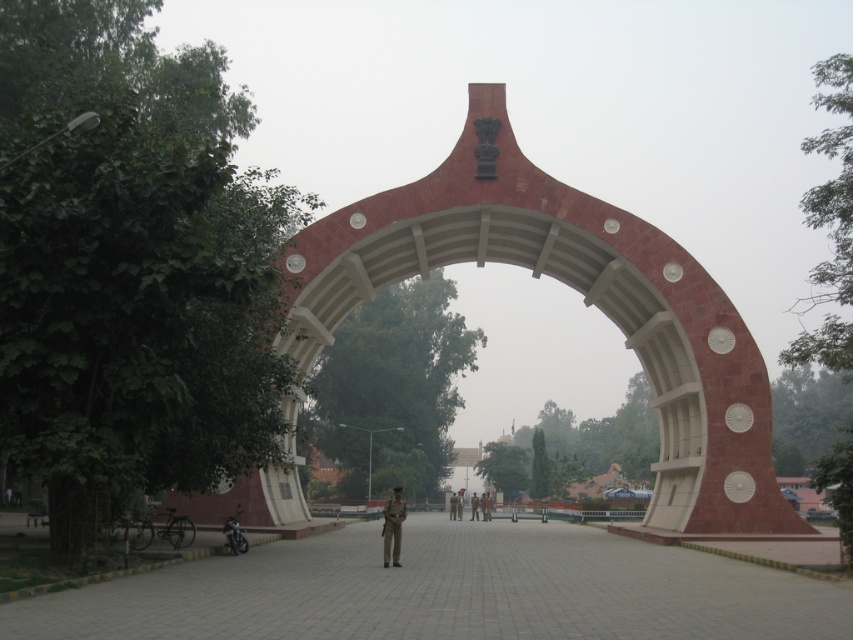
Question: Does red stone archway at center appear on the right side of paved stone path at center?

Choices:
 (A) yes
 (B) no

Answer: (A)

Question: Which object appears closest to the camera in this image?

Choices:
 (A) brown uniform at center
 (B) paved stone path at center
 (C) red uniformed person at center

Answer: (B)

Question: Which is nearer to the brown uniform at center?

Choices:
 (A) red stone archway at center
 (B) paved stone path at center
 (C) uniformed officer at center

Answer: (C)

Question: Is red uniformed person at center further to the viewer compared to brown uniform at center?

Choices:
 (A) yes
 (B) no

Answer: (B)

Question: Which point appears farthest from the camera in this image?

Choices:
 (A) (386, 557)
 (B) (564, 595)
 (C) (302, 304)

Answer: (C)

Question: Does red stone archway at center have a greater width compared to paved stone path at center?

Choices:
 (A) yes
 (B) no

Answer: (A)